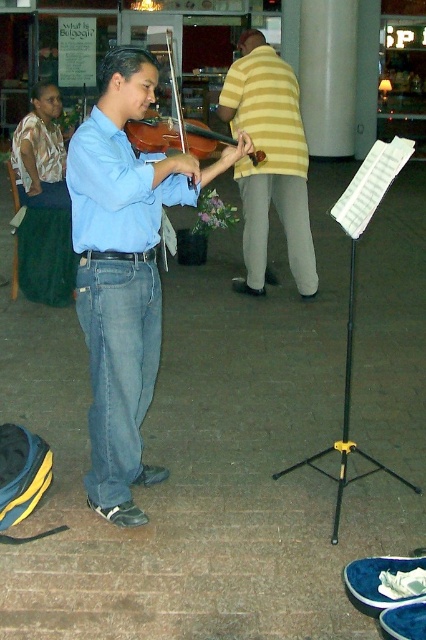
Can you confirm if denim jeans at center is positioned above wooden violin at center?

No.

Is denim jeans at center thinner than wooden violin at center?

Yes.

Describe the element at coordinates (118, 365) in the screenshot. I see `denim jeans at center` at that location.

Identify the location of denim jeans at center. (118, 365).

Which is more to the left, matte blue shirt at center or yellow striped shirt at center?

From the viewer's perspective, matte blue shirt at center appears more on the left side.

From the picture: Measure the distance from matte blue shirt at center to yellow striped shirt at center.

A distance of 2.56 meters exists between matte blue shirt at center and yellow striped shirt at center.

What do you see at coordinates (123, 272) in the screenshot? I see `matte blue shirt at center` at bounding box center [123, 272].

Locate an element on the screen. This screenshot has width=426, height=640. matte blue shirt at center is located at coordinates (123, 272).

From the picture: Can you confirm if matte blue shirt at center is bigger than denim jeans at center?

Correct, matte blue shirt at center is larger in size than denim jeans at center.

Is point (100, 237) more distant than point (109, 333)?

No, (100, 237) is in front of (109, 333).

Is point (164, 186) closer to camera compared to point (111, 497)?

No, (164, 186) is behind (111, 497).

Where is `matte blue shirt at center`? matte blue shirt at center is located at coordinates coord(123,272).